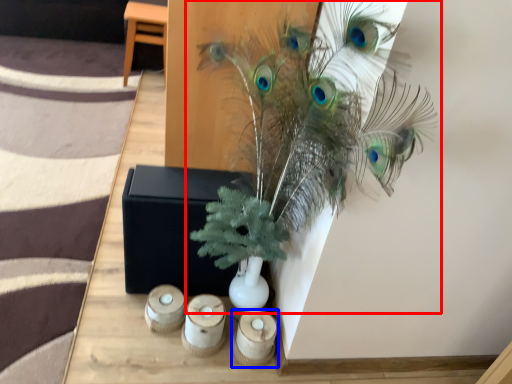
Question: Which object is closer to the camera taking this photo, houseplant (highlighted by a red box) or candle holder (highlighted by a blue box)?

Choices:
 (A) houseplant
 (B) candle holder

Answer: (A)